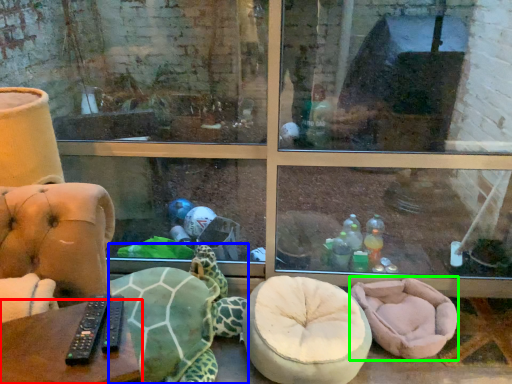
Question: Considering the real-world distances, which object is closest to table (highlighted by a red box)? tortoise (highlighted by a blue box) or bean bag chair (highlighted by a green box).

Choices:
 (A) tortoise
 (B) bean bag chair

Answer: (A)